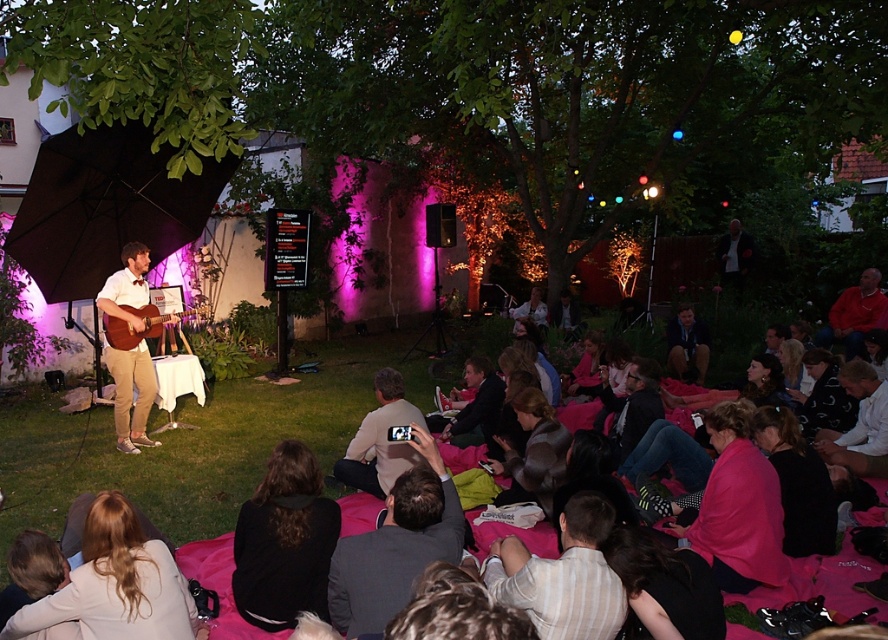
You are organizing a photo shoot for the event and need to position a camera 40 feet away from the dark gray suit at center. Is the white shirt at upper right within the camera position area?

The dark gray suit at center is 41.54 feet from the white shirt at upper right. To position the camera 40 feet away from the dark gray suit at center, the camera would be placed closer than the distance to the white shirt at upper right. Therefore, the white shirt at upper right would be just beyond the camera position area.

You are attending an outdoor evening event in a garden. You see a red cotton shirt at lower right and a camera. If you want to take a photo of the stage, which object should you move closer to?

To take a photo of the stage, you should move closer to the camera since the red cotton shirt at lower right and the camera are 8.45 meters apart, meaning the camera is farther away from you than the red cotton shirt at lower right. Moving closer to the camera would allow you to use it for capturing the stage.

You are an event photographer at the concert. You need to capture a photo that includes both the red cotton shirt at lower right and the wooden acoustic guitar at left. Based on their positions, which one is on the right side?

The red cotton shirt at lower right is positioned on the right side of wooden acoustic guitar at left.